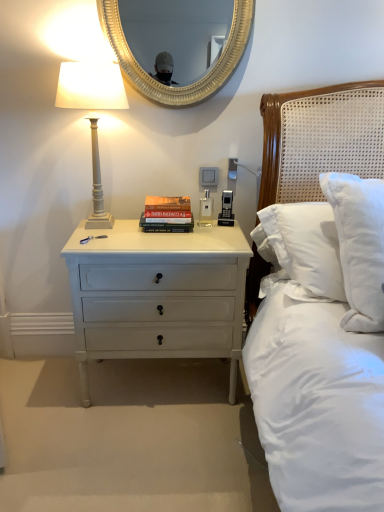
Question: In terms of width, does white painted wood nightstand at lower left look wider or thinner when compared to gold textured mirror at upper center?

Choices:
 (A) wide
 (B) thin

Answer: (A)

Question: Is white painted wood nightstand at lower left taller or shorter than gold textured mirror at upper center?

Choices:
 (A) short
 (B) tall

Answer: (B)

Question: Estimate the real-world distances between objects in this image. Which object is farther from the gold textured mirror at upper center?

Choices:
 (A) hardcover book at center
 (B) white painted wood nightstand at lower left
 (C) white painted wood bedside lamp at left

Answer: (B)

Question: Based on their relative distances, which object is farther from the white painted wood bedside lamp at left?

Choices:
 (A) gold textured mirror at upper center
 (B) hardcover book at center
 (C) white painted wood nightstand at lower left

Answer: (A)